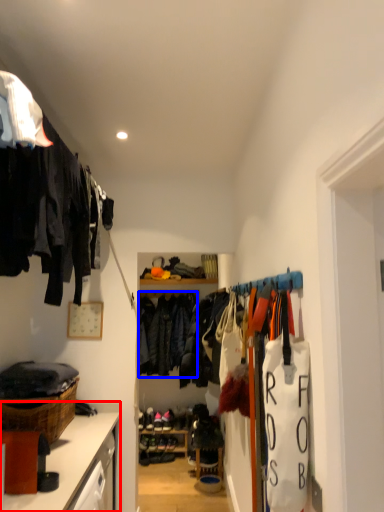
Question: Which object appears farthest to the camera in this image, cabinetry (highlighted by a red box) or clothing (highlighted by a blue box)?

Choices:
 (A) cabinetry
 (B) clothing

Answer: (B)